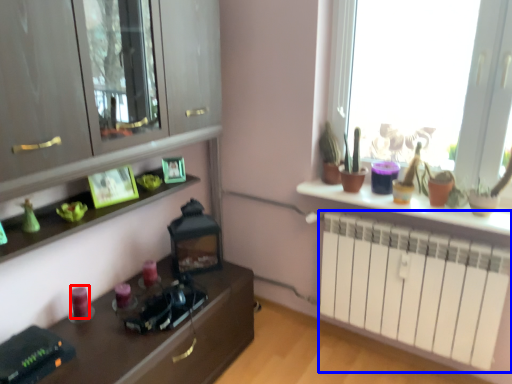
Question: Which object appears closest to the camera in this image, candle (highlighted by a red box) or radiator (highlighted by a blue box)?

Choices:
 (A) candle
 (B) radiator

Answer: (B)